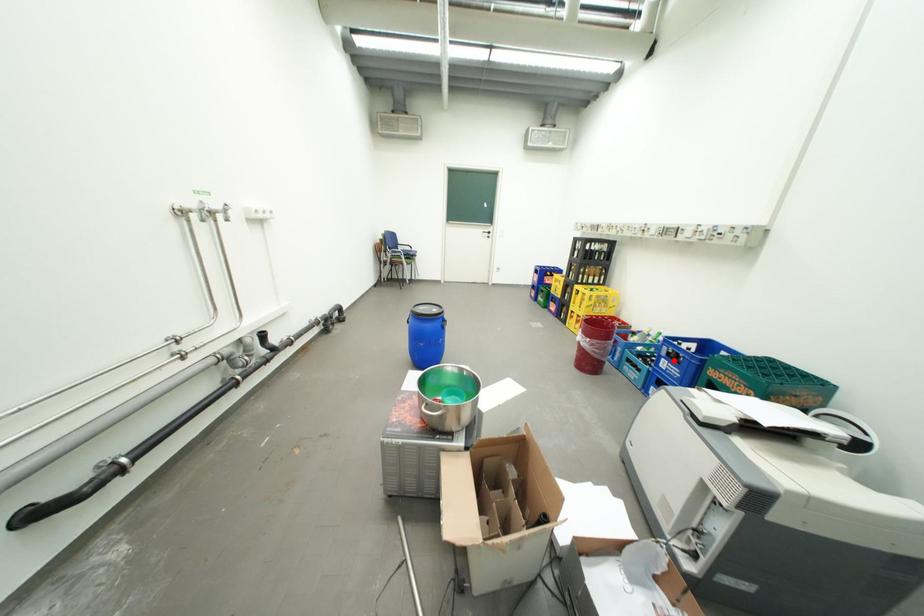
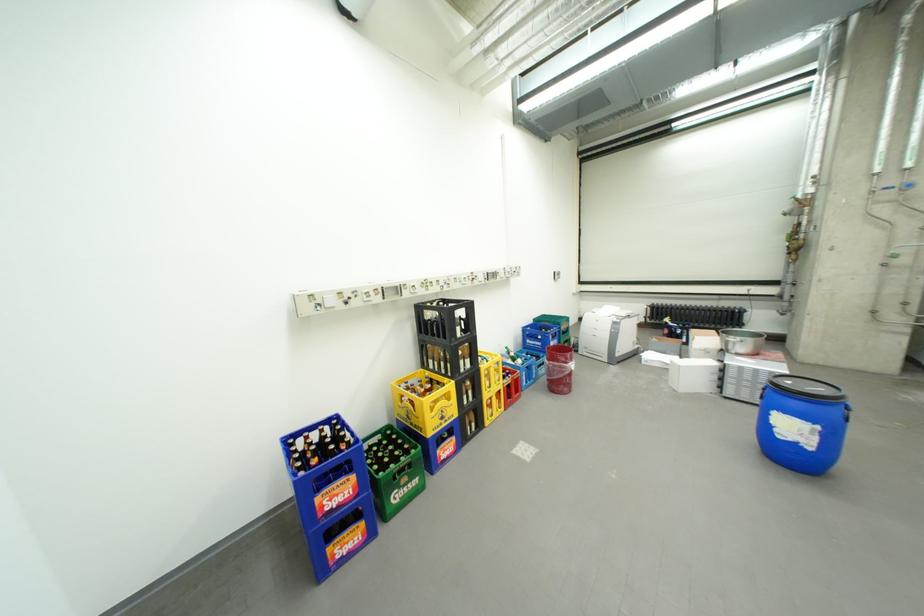
Question: I am providing you with two images of the same scene from different viewpoints. Image1 has a red point marked. In image2, the corresponding 3D location appears at what relative position? Reply with the corresponding letter.

Choices:
 (A) Closer
 (B) Farther

Answer: (B)